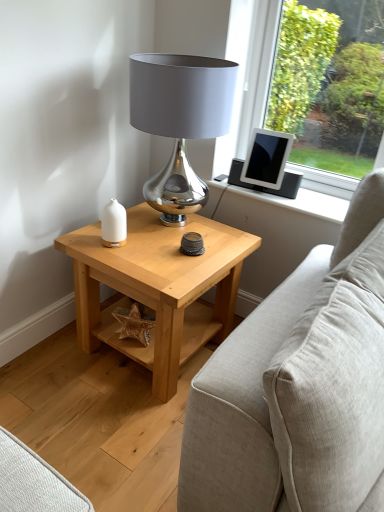
Question: From the image's perspective, is white matte candle holder at left over beige fabric couch at right?

Choices:
 (A) yes
 (B) no

Answer: (A)

Question: Is white matte candle holder at left far away from beige fabric couch at right?

Choices:
 (A) yes
 (B) no

Answer: (B)

Question: Is white matte candle holder at left oriented away from beige fabric couch at right?

Choices:
 (A) yes
 (B) no

Answer: (B)

Question: Is white matte candle holder at left at the right side of beige fabric couch at right?

Choices:
 (A) yes
 (B) no

Answer: (B)

Question: Can you confirm if white matte candle holder at left is wider than beige fabric couch at right?

Choices:
 (A) yes
 (B) no

Answer: (B)

Question: Is white matte candle holder at left further to camera compared to beige fabric couch at right?

Choices:
 (A) yes
 (B) no

Answer: (A)

Question: Is light wood/texture side table at center positioned with its back to beige fabric couch at right?

Choices:
 (A) no
 (B) yes

Answer: (A)

Question: From a real-world perspective, is light wood/texture side table at center under beige fabric couch at right?

Choices:
 (A) no
 (B) yes

Answer: (B)

Question: From the image's perspective, is light wood/texture side table at center below beige fabric couch at right?

Choices:
 (A) no
 (B) yes

Answer: (A)

Question: Can you confirm if light wood/texture side table at center is taller than beige fabric couch at right?

Choices:
 (A) yes
 (B) no

Answer: (B)

Question: Are light wood/texture side table at center and beige fabric couch at right making contact?

Choices:
 (A) no
 (B) yes

Answer: (A)

Question: Is light wood/texture side table at center completely or partially outside of beige fabric couch at right?

Choices:
 (A) yes
 (B) no

Answer: (A)

Question: Does shiny metallic lamp at center touch light wood/texture side table at center?

Choices:
 (A) no
 (B) yes

Answer: (A)